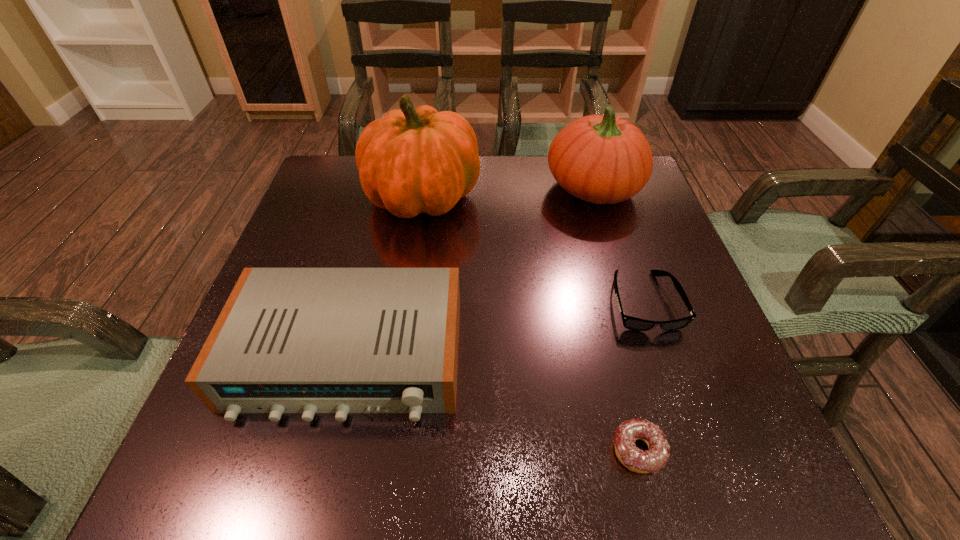
The image size is (960, 540). What are the coordinates of `the left pumpkin` in the screenshot? It's located at (417, 160).

Locate an element on the screen. The height and width of the screenshot is (540, 960). the taller pumpkin is located at coordinates (417, 160).

The width and height of the screenshot is (960, 540). I want to click on the shorter pumpkin, so click(601, 159).

Identify the location of the right pumpkin. This screenshot has width=960, height=540. (601, 159).

You are a GUI agent. You are given a task and a screenshot of the screen. Output one action in this format:
    pyautogui.click(x=<x>, y=<y>)
    Task: Click on the third tallest object
    
    Given the screenshot: What is the action you would take?
    pyautogui.click(x=288, y=340)

What are the coordinates of `sunglasses` in the screenshot? It's located at (632, 323).

Where is `doughnut`? The width and height of the screenshot is (960, 540). doughnut is located at coordinates (651, 461).

Where is `free point located 0.180m on the front of the taller pumpkin`? The height and width of the screenshot is (540, 960). free point located 0.180m on the front of the taller pumpkin is located at coordinates (408, 289).

Identify the location of vacant position located 0.190m on the front of the right pumpkin. (620, 275).

At what (x,y) coordinates should I click in order to perform the action: click on vacant region located 0.080m on the control panel of the third shortest object. Please return your answer as a coordinate pair (x, y). The height and width of the screenshot is (540, 960). Looking at the image, I should click on (318, 477).